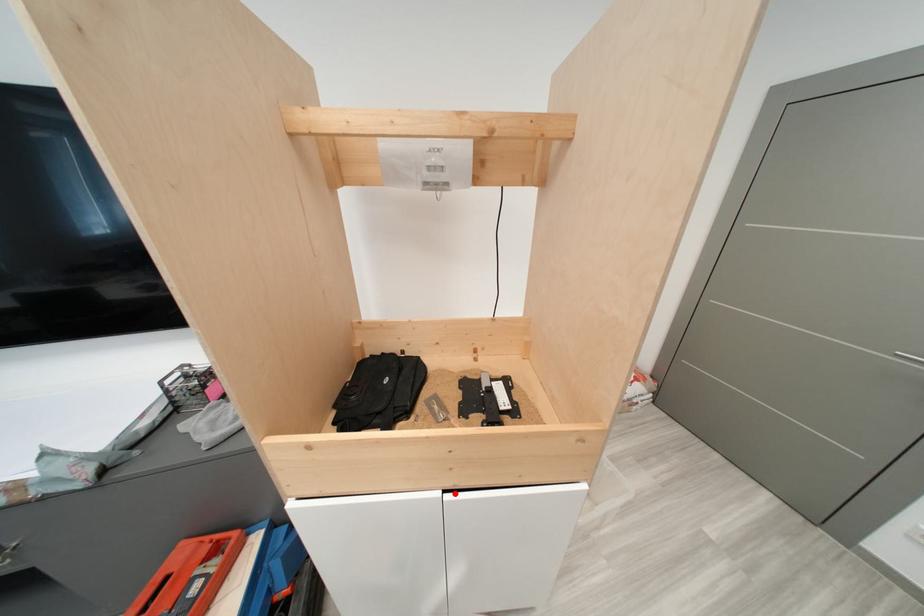
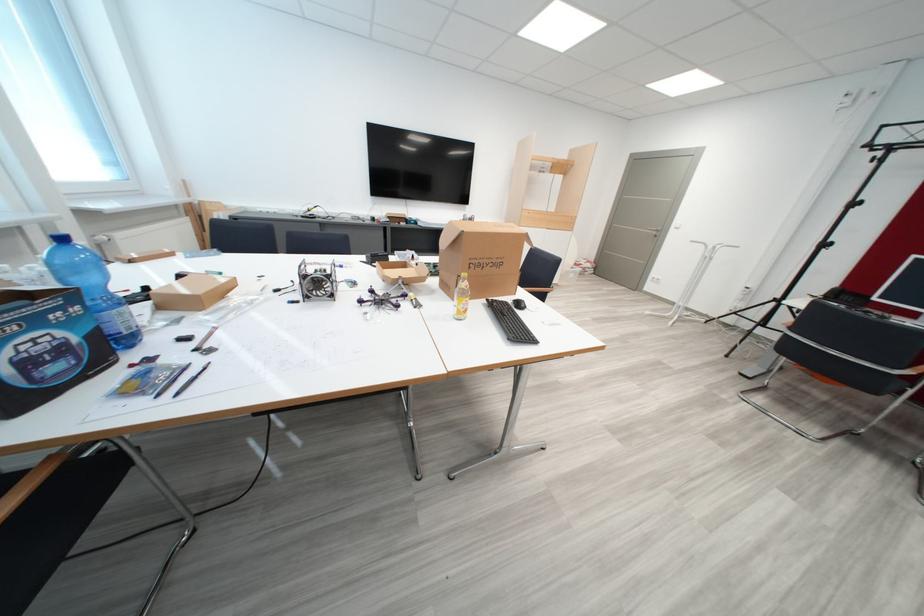
Question: I am providing you with two images of the same scene from different viewpoints. Image1 has a red point marked. In image2, the corresponding 3D location appears at what relative position? Reply with the corresponding letter.

Choices:
 (A) Closer
 (B) Farther

Answer: (A)